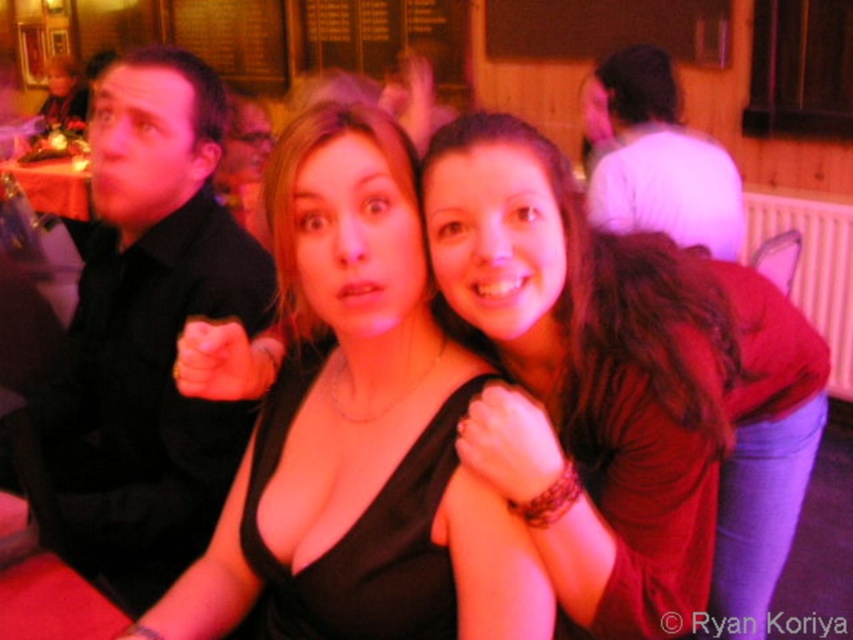
Question: Which of the following is the closest to the observer?

Choices:
 (A) [328, 616]
 (B) [103, 113]
 (C) [236, 476]

Answer: (A)

Question: Can you confirm if matte black dress at center is positioned to the left of black matte dress at center?

Choices:
 (A) yes
 (B) no

Answer: (B)

Question: Is black matte dress at center positioned behind black satin dress at center?

Choices:
 (A) yes
 (B) no

Answer: (B)

Question: Which object appears farthest from the camera in this image?

Choices:
 (A) matte black dress at center
 (B) white matte shirt at upper center
 (C) black satin dress at center
 (D) black shirt at left

Answer: (B)

Question: Does black matte dress at center appear on the right side of black satin dress at center?

Choices:
 (A) no
 (B) yes

Answer: (B)

Question: Which point is closer to the camera?

Choices:
 (A) matte black dress at center
 (B) black matte dress at center
 (C) white matte shirt at upper center
 (D) black satin dress at center

Answer: (A)